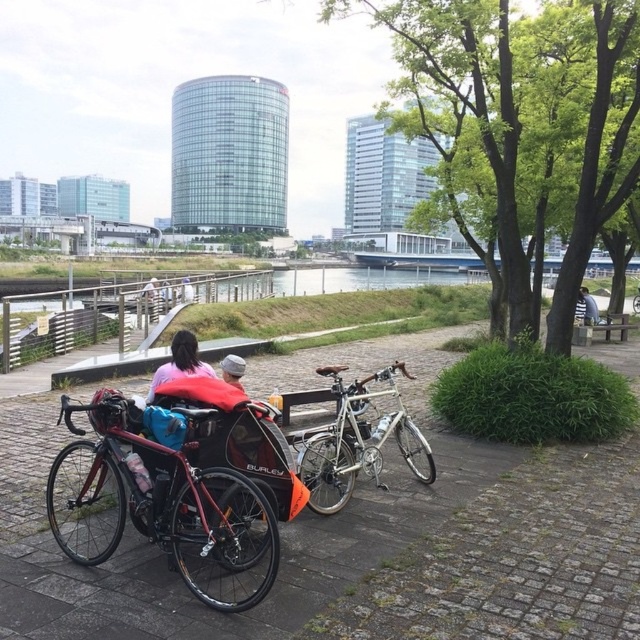
Is shiny metallic bicycle at center positioned in front of blue fabric backpack at center?

Yes, it is.

Which is below, shiny metallic bicycle at center or blue fabric backpack at center?

shiny metallic bicycle at center

Which is in front, point (72, 522) or point (593, 323)?

Point (72, 522) is in front.

What are the coordinates of `shiny metallic bicycle at center` in the screenshot? It's located at (163, 493).

In the scene shown: Which of these two, pink fabric at center or light blue fabric at center, stands taller?

With more height is light blue fabric at center.

Who is positioned more to the right, pink fabric at center or light blue fabric at center?

pink fabric at center

Does point (180, 349) come farther from viewer compared to point (184, 296)?

No, (180, 349) is in front of (184, 296).

Where is `pink fabric at center`? The image size is (640, 640). pink fabric at center is located at coordinates (180, 362).

Find the location of a particular element. silver metallic bicycle at center is located at coordinates (356, 440).

Between silver metallic bicycle at center and light blue fabric at center, which one appears on the left side from the viewer's perspective?

From the viewer's perspective, light blue fabric at center appears more on the left side.

Is point (364, 401) positioned after point (189, 298)?

No, (364, 401) is closer to viewer.

Locate an element on the screen. This screenshot has height=640, width=640. silver metallic bicycle at center is located at coordinates (356, 440).